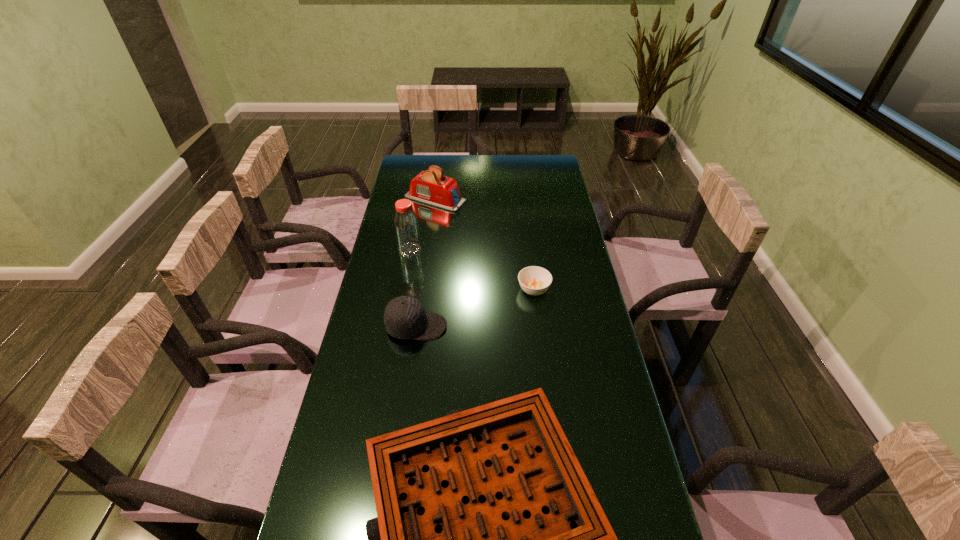
Find the location of a particular element. free space located on the back of the third nearest object is located at coordinates (527, 234).

At what (x,y) coordinates should I click in order to perform the action: click on bottle present at the left edge. Please return your answer as a coordinate pair (x, y). Looking at the image, I should click on (x=406, y=225).

This screenshot has width=960, height=540. I want to click on toaster that is at the left edge, so pyautogui.click(x=430, y=187).

Locate an element on the screen. baseball cap located at the left edge is located at coordinates (405, 317).

This screenshot has width=960, height=540. I want to click on object situated at the right edge, so click(534, 280).

This screenshot has height=540, width=960. In the image, there is a desktop. In order to click on vacant space at the far edge in this screenshot , I will do `click(478, 163)`.

The image size is (960, 540). What are the coordinates of `vacant area at the left edge` in the screenshot? It's located at tap(353, 404).

The image size is (960, 540). Find the location of `free space at the right edge of the desktop`. free space at the right edge of the desktop is located at coordinates (551, 191).

At what (x,y) coordinates should I click in order to perform the action: click on free space at the far right corner of the desktop. Please return your answer as a coordinate pair (x, y). Looking at the image, I should click on (543, 178).

Find the location of a particular element. Image resolution: width=960 pixels, height=540 pixels. vacant area between the baseball cap and the soup bowl is located at coordinates (475, 308).